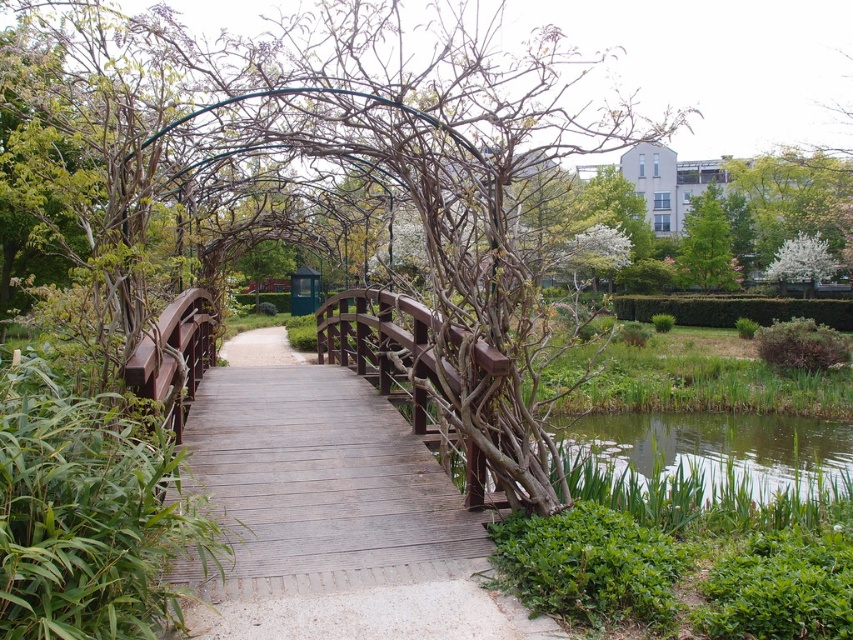
How much distance is there between brown wood bridge at center and green grassy water at lower right?

The distance of brown wood bridge at center from green grassy water at lower right is 5.35 meters.

This screenshot has height=640, width=853. I want to click on brown wood bridge at center, so click(335, 180).

Which is behind, point (646, 136) or point (611, 493)?

Positioned behind is point (611, 493).

Locate an element on the screen. brown wood bridge at center is located at coordinates (335, 180).

From the picture: Can you confirm if green grassy water at lower right is thinner than green leafy tree at upper right?

Incorrect, green grassy water at lower right's width is not less than green leafy tree at upper right's.

The width and height of the screenshot is (853, 640). I want to click on green grassy water at lower right, so click(x=699, y=458).

Between point (837, 460) and point (717, 243), which one is positioned in front?

Point (837, 460)

You are a GUI agent. You are given a task and a screenshot of the screen. Output one action in this format:
    pyautogui.click(x=<x>, y=<y>)
    Task: Click on the green grassy water at lower right
    The image size is (853, 640).
    Given the screenshot: What is the action you would take?
    pyautogui.click(x=699, y=458)

What do you see at coordinates (335, 180) in the screenshot? I see `brown wood bridge at center` at bounding box center [335, 180].

What do you see at coordinates (335, 180) in the screenshot? Image resolution: width=853 pixels, height=640 pixels. I see `brown wood bridge at center` at bounding box center [335, 180].

Where is `brown wood bridge at center`? Image resolution: width=853 pixels, height=640 pixels. brown wood bridge at center is located at coordinates (335, 180).